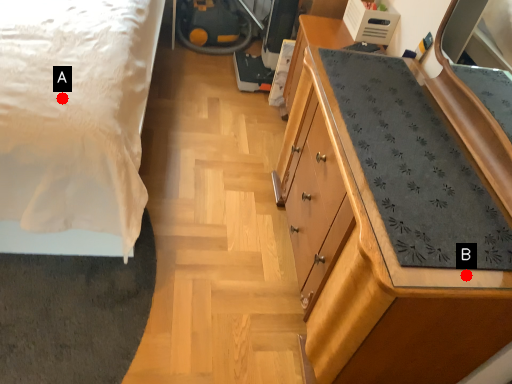
Question: Two points are circled on the image, labeled by A and B beside each circle. Among these points, which one is nearest to the camera?

Choices:
 (A) A is closer
 (B) B is closer

Answer: (B)